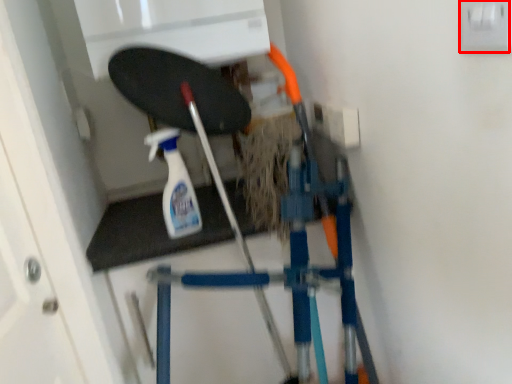
Question: Observing the image, what is the correct spatial positioning of electric outlet (annotated by the red box) in reference to cleaning product?

Choices:
 (A) left
 (B) right

Answer: (B)